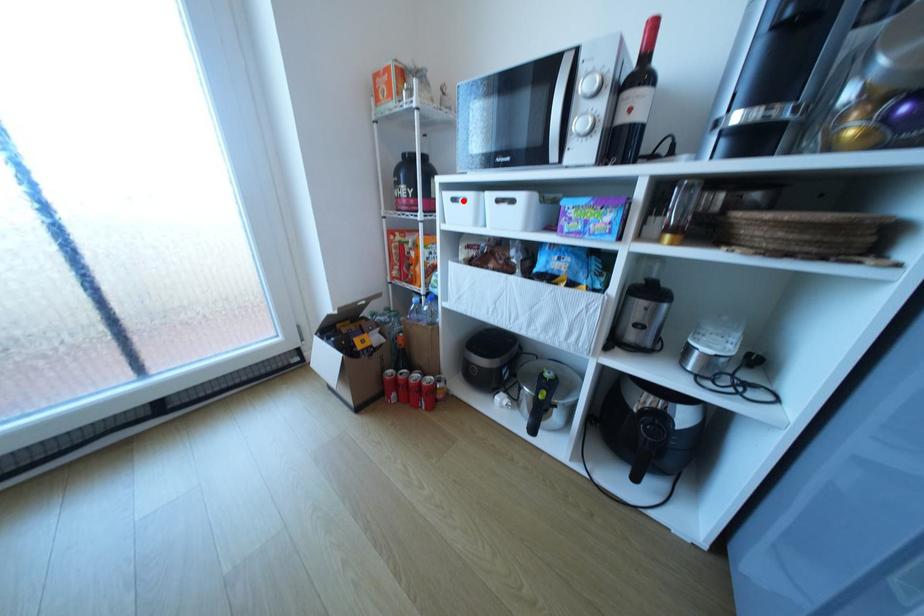
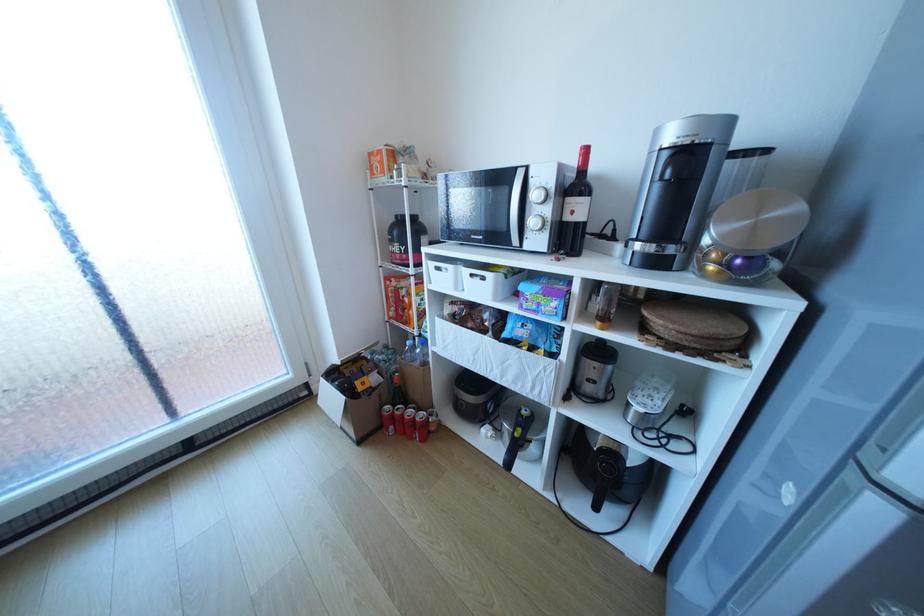
Question: A red point is marked in image1. In image2, is the corresponding 3D point closer to the camera or farther? Reply with the corresponding letter.

Choices:
 (A) The corresponding 3D point is closer.
 (B) The corresponding 3D point is farther.

Answer: (B)